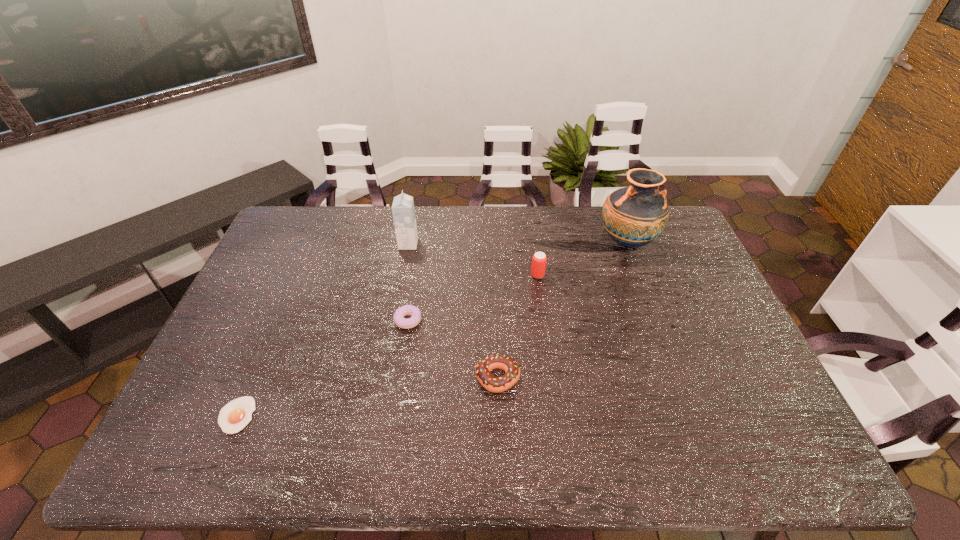
Locate which object ranks fourth in proximity to the fourth shortest object. Please provide its 2D coordinates. Your answer should be formatted as a tuple, i.e. [(x, y)], where the tuple contains the x and y coordinates of a point satisfying the conditions above.

[(403, 211)]

Select which object appears as the third closest to the fifth farthest object. Please provide its 2D coordinates. Your answer should be formatted as a tuple, i.e. [(x, y)], where the tuple contains the x and y coordinates of a point satisfying the conditions above.

[(633, 216)]

Find the location of `vacant region that satisfies the following two spatial constraints: 1. on the front label of the carton; 2. on the right side of the shorter doughnut`. vacant region that satisfies the following two spatial constraints: 1. on the front label of the carton; 2. on the right side of the shorter doughnut is located at coordinates tap(395, 321).

The height and width of the screenshot is (540, 960). I want to click on vacant region that satisfies the following two spatial constraints: 1. on the front label of the carton; 2. on the left side of the left doughnut, so click(395, 321).

Where is `vacant space that satisfies the following two spatial constraints: 1. on the back side of the rightmost object; 2. on the right side of the third shortest object`? The image size is (960, 540). vacant space that satisfies the following two spatial constraints: 1. on the back side of the rightmost object; 2. on the right side of the third shortest object is located at coordinates (493, 242).

Find the location of a particular element. vacant space that satisfies the following two spatial constraints: 1. on the front label of the second shortest object; 2. on the right side of the carton is located at coordinates (395, 321).

Identify the location of free space that satisfies the following two spatial constraints: 1. on the front label of the right doughnut; 2. on the left side of the second tallest object. The width and height of the screenshot is (960, 540). (384, 378).

At what (x,y) coordinates should I click in order to perform the action: click on free space that satisfies the following two spatial constraints: 1. on the front label of the carton; 2. on the back side of the left doughnut. Please return your answer as a coordinate pair (x, y). Looking at the image, I should click on (395, 321).

Locate an element on the screen. free location that satisfies the following two spatial constraints: 1. on the back side of the second shortest object; 2. on the left side of the shortest object is located at coordinates (277, 321).